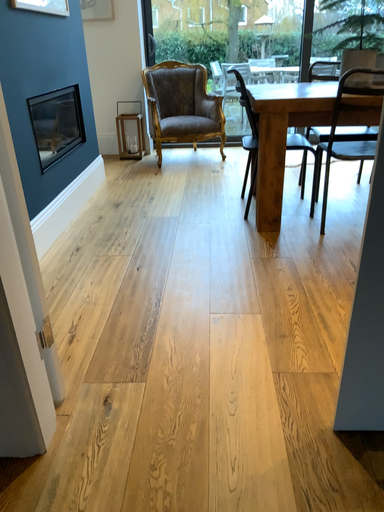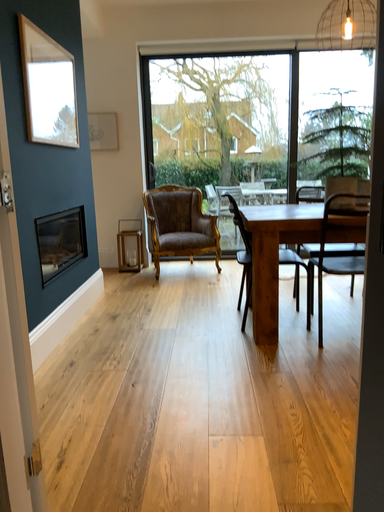
Question: Which way did the camera rotate in the video?

Choices:
 (A) rotated downward
 (B) rotated upward

Answer: (B)